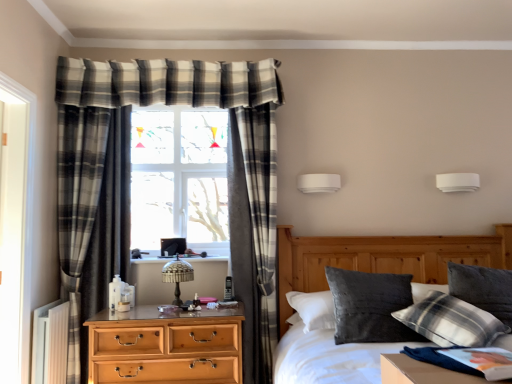
Question: From their relative heights in the image, would you say white plastic radiator at lower left is taller or shorter than plaid fabric pillow at upper right, which is the 1th pillow from right to left?

Choices:
 (A) tall
 (B) short

Answer: (A)

Question: Considering their positions, is white plastic radiator at lower left located in front of or behind plaid fabric pillow at upper right, which is the 1th pillow from right to left?

Choices:
 (A) front
 (B) behind

Answer: (B)

Question: Which object is the closest to the translucent glass table lamp at center?

Choices:
 (A) velvety dark gray pillow at center-right, marked as the second pillow in a right-to-left arrangement
 (B) white plastic radiator at lower left
 (C) white glossy screen door at left
 (D) white matte wall sconce at upper center
 (E) plaid fabric pillow at upper right, which is the 1th pillow from right to left

Answer: (B)

Question: Estimate the real-world distances between objects in this image. Which object is farther from the velvety dark gray pillow at center-right, marked as the second pillow in a right-to-left arrangement?

Choices:
 (A) plaid fabric curtain at center
 (B) white glossy screen door at left
 (C) white matte wall sconce at upper center
 (D) velvet grey pillow at center
 (E) plaid fabric pillow at upper right, the 2th pillow viewed from the left

Answer: (B)